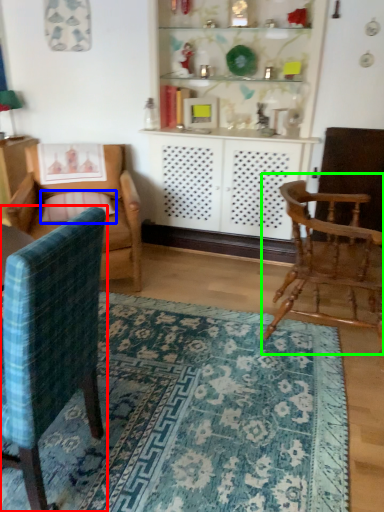
Question: Which object is positioned farthest from chair (highlighted by a red box)? Select from pillow (highlighted by a blue box) and chair (highlighted by a green box).

Choices:
 (A) pillow
 (B) chair

Answer: (A)